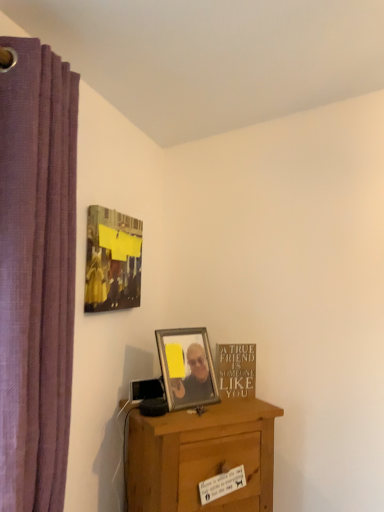
Question: Is purple fabric curtain at left to the left or to the right of metallic silver picture frame at center, acting as the 2th picture frame starting from the top, in the image?

Choices:
 (A) right
 (B) left

Answer: (B)

Question: Looking at their shapes, would you say purple fabric curtain at left is wider or thinner than metallic silver picture frame at center, which appears as the first picture frame when viewed from the right?

Choices:
 (A) thin
 (B) wide

Answer: (B)

Question: Which object is the farthest from the metallic silver picture frame at center, which appears as the first picture frame when viewed from the right?

Choices:
 (A) matte black picture frame at upper left, the second picture frame from the right
 (B) gold metallic sign at lower right
 (C) wooden desk at lower center
 (D) purple fabric curtain at left

Answer: (D)

Question: Estimate the real-world distances between objects in this image. Which object is closer to the purple fabric curtain at left?

Choices:
 (A) metallic silver picture frame at center, acting as the 2th picture frame starting from the top
 (B) wooden desk at lower center
 (C) gold metallic sign at lower right
 (D) matte black picture frame at upper left, placed as the first picture frame when sorted from top to bottom

Answer: (D)